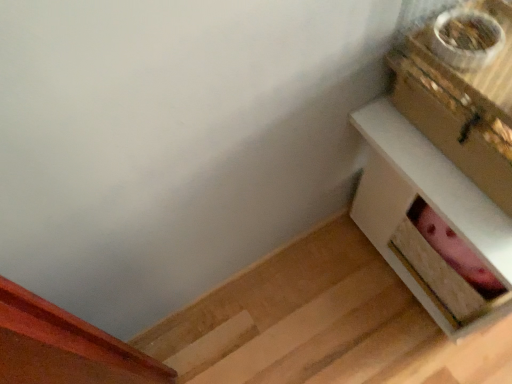
Identify the location of white wood table at right. (x=429, y=221).

What do you see at coordinates (429, 221) in the screenshot? The width and height of the screenshot is (512, 384). I see `white wood table at right` at bounding box center [429, 221].

This screenshot has height=384, width=512. Describe the element at coordinates (463, 91) in the screenshot. I see `gold metallic box at upper right` at that location.

Locate an element on the screen. This screenshot has height=384, width=512. gold metallic box at upper right is located at coordinates (463, 91).

You are a GUI agent. You are given a task and a screenshot of the screen. Output one action in this format:
    pyautogui.click(x=<x>, y=<y>)
    Task: Click on the white wood table at right
    The height and width of the screenshot is (384, 512).
    Given the screenshot: What is the action you would take?
    pyautogui.click(x=429, y=221)

Considering the relative positions of white wood table at right and gold metallic box at upper right in the image provided, is white wood table at right to the right of gold metallic box at upper right from the viewer's perspective?

Yes.

Is white wood table at right in front of gold metallic box at upper right?

No, white wood table at right is behind gold metallic box at upper right.

Considering the positions of point (434, 277) and point (458, 158), is point (434, 277) closer or farther from the camera than point (458, 158)?

Point (434, 277).

From the image's perspective, which is above, white wood table at right or gold metallic box at upper right?

gold metallic box at upper right appears higher in the image.

From a real-world perspective, does white wood table at right stand above gold metallic box at upper right?

Incorrect, from a real-world perspective, white wood table at right is lower than gold metallic box at upper right.

Does white wood table at right have a greater width compared to gold metallic box at upper right?

Yes.

Considering the relative sizes of white wood table at right and gold metallic box at upper right in the image provided, is white wood table at right taller than gold metallic box at upper right?

Correct, white wood table at right is much taller as gold metallic box at upper right.

Considering the relative sizes of white wood table at right and gold metallic box at upper right in the image provided, is white wood table at right bigger than gold metallic box at upper right?

Yes.

Would you say gold metallic box at upper right is part of white wood table at right's contents?

No, white wood table at right does not contain gold metallic box at upper right.

Is white wood table at right next to gold metallic box at upper right?

No, white wood table at right is not making contact with gold metallic box at upper right.

Is gold metallic box at upper right at the back of white wood table at right?

white wood table at right does not have its back to gold metallic box at upper right.

How many degrees apart are the facing directions of white wood table at right and gold metallic box at upper right?

The angle between the facing direction of white wood table at right and the facing direction of gold metallic box at upper right is 2.21e-05 degrees.

Locate an element on the screen. The image size is (512, 384). box above the white wood table at right (from the image's perspective) is located at coordinates (463, 91).

Can you confirm if gold metallic box at upper right is positioned to the left of white wood table at right?

Correct, you'll find gold metallic box at upper right to the left of white wood table at right.

Is gold metallic box at upper right in front of or behind white wood table at right in the image?

Clearly, gold metallic box at upper right is in front of white wood table at right.

Does point (443, 73) lie behind point (410, 219)?

No, (443, 73) is closer to viewer.

From the image's perspective, is gold metallic box at upper right below white wood table at right?

Actually, gold metallic box at upper right appears above white wood table at right in the image.

From a real-world perspective, between gold metallic box at upper right and white wood table at right, who is vertically higher?

From a 3D spatial view, gold metallic box at upper right is above.

Is gold metallic box at upper right wider than white wood table at right?

In fact, gold metallic box at upper right might be narrower than white wood table at right.

Which of these two, gold metallic box at upper right or white wood table at right, stands taller?

white wood table at right.

Looking at the image, does gold metallic box at upper right seem bigger or smaller compared to white wood table at right?

Considering their sizes, gold metallic box at upper right takes up less space than white wood table at right.

Which is correct: gold metallic box at upper right is inside white wood table at right, or outside of it?

gold metallic box at upper right is outside white wood table at right.

Is gold metallic box at upper right far away from white wood table at right?

No.

Is gold metallic box at upper right oriented towards white wood table at right?

No, gold metallic box at upper right is not turned towards white wood table at right.

How far apart are gold metallic box at upper right and white wood table at right?

7.15 inches.

Identify the location of box that is in front of the white wood table at right. Image resolution: width=512 pixels, height=384 pixels. (463, 91).

You are a GUI agent. You are given a task and a screenshot of the screen. Output one action in this format:
    pyautogui.click(x=<x>, y=<y>)
    Task: Click on the table below the gold metallic box at upper right (from a real-world perspective)
    This screenshot has width=512, height=384.
    Given the screenshot: What is the action you would take?
    pyautogui.click(x=429, y=221)

You are a GUI agent. You are given a task and a screenshot of the screen. Output one action in this format:
    pyautogui.click(x=<x>, y=<y>)
    Task: Click on the table below the gold metallic box at upper right (from the image's perspective)
    The width and height of the screenshot is (512, 384).
    Given the screenshot: What is the action you would take?
    pyautogui.click(x=429, y=221)